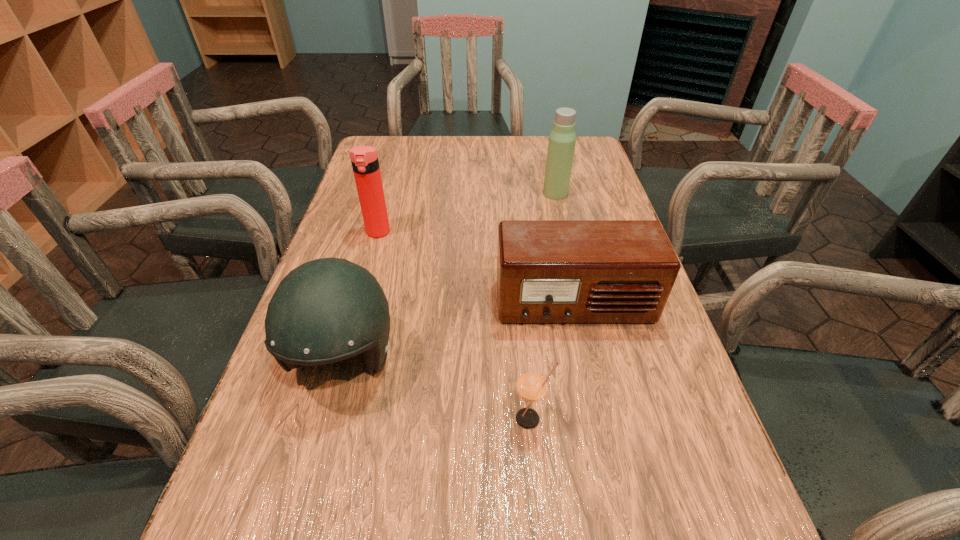
Where is `vacant area situated 0.100m on the front-facing side of the radio receiver`? This screenshot has height=540, width=960. vacant area situated 0.100m on the front-facing side of the radio receiver is located at coordinates (589, 373).

Find the location of a particular element. The image size is (960, 540). free location located 0.210m on the left of the straw is located at coordinates (389, 418).

Where is `thermos bottle that is at the left edge`? The image size is (960, 540). thermos bottle that is at the left edge is located at coordinates pos(364,159).

The width and height of the screenshot is (960, 540). Identify the location of football helmet that is at the left edge. (326, 310).

At what (x,y) coordinates should I click in order to perform the action: click on thermos bottle at the right edge. Please return your answer as a coordinate pair (x, y). Looking at the image, I should click on (562, 139).

Where is `radio receiver located in the right edge section of the desktop`? The width and height of the screenshot is (960, 540). radio receiver located in the right edge section of the desktop is located at coordinates (548, 271).

Image resolution: width=960 pixels, height=540 pixels. I want to click on free space at the far edge of the desktop, so click(417, 156).

Identify the location of free spot at the left edge of the desktop. The image size is (960, 540). (389, 255).

Locate an element on the screen. free space at the right edge is located at coordinates (671, 464).

Where is `vacant space at the far left corner of the desktop`? The image size is (960, 540). vacant space at the far left corner of the desktop is located at coordinates (386, 165).